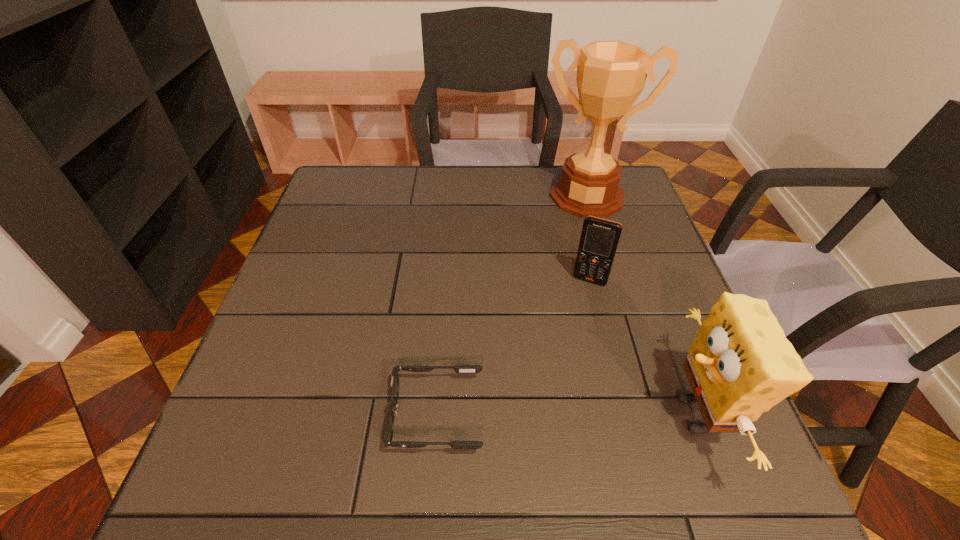
You are a GUI agent. You are given a task and a screenshot of the screen. Output one action in this format:
    pyautogui.click(x=<x>, y=<y>)
    Task: Click on the free space located on the face of the third shortest object
    This screenshot has height=540, width=960.
    Given the screenshot: What is the action you would take?
    pyautogui.click(x=564, y=415)

The width and height of the screenshot is (960, 540). In order to click on vacant region located 0.240m on the face of the third shortest object in this screenshot , I will do `click(531, 415)`.

What are the coordinates of `vacant space situated on the face of the third shortest object` in the screenshot? It's located at (559, 415).

This screenshot has height=540, width=960. In order to click on free space located 0.070m on the front-facing side of the tallest object in this screenshot , I will do `click(574, 232)`.

Identify the location of free space located on the front-facing side of the tallest object. This screenshot has height=540, width=960. (569, 248).

This screenshot has height=540, width=960. What are the coordinates of `blank space located on the front-facing side of the tallest object` in the screenshot? It's located at (557, 298).

Locate an element on the screen. This screenshot has height=540, width=960. vacant space situated on the screen of the third tallest object is located at coordinates (559, 355).

Find the location of a particular element. free space located 0.140m on the screen of the third tallest object is located at coordinates (568, 330).

Locate an element on the screen. The height and width of the screenshot is (540, 960). free space located 0.360m on the screen of the third tallest object is located at coordinates coord(536,418).

This screenshot has height=540, width=960. I want to click on object present at the far edge, so click(611, 75).